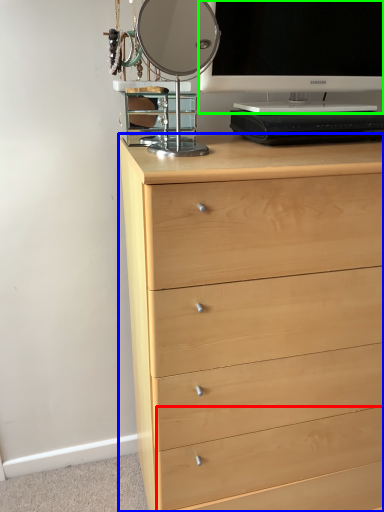
Question: Which is nearer to the drawer (highlighted by a red box)? chest of drawers (highlighted by a blue box) or television (highlighted by a green box).

Choices:
 (A) chest of drawers
 (B) television

Answer: (A)